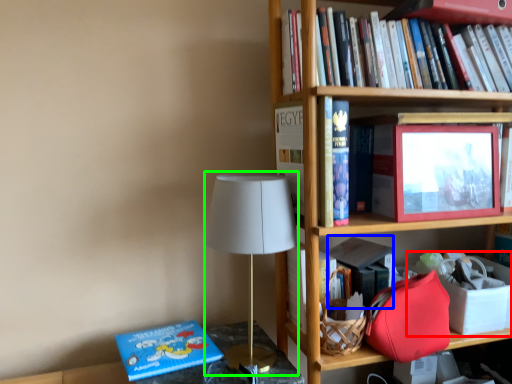
Question: Which is nearer to the box (highlighted by a red box)? paperback book (highlighted by a blue box) or table lamp (highlighted by a green box).

Choices:
 (A) paperback book
 (B) table lamp

Answer: (A)